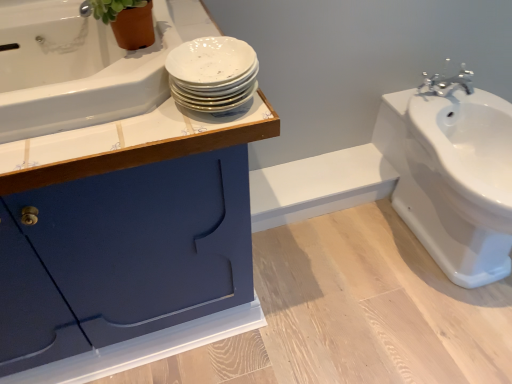
Question: Is white glossy bathtub at upper left oriented towards green matte plant at upper left?

Choices:
 (A) no
 (B) yes

Answer: (A)

Question: Is white glossy bathtub at upper left not near green matte plant at upper left?

Choices:
 (A) yes
 (B) no

Answer: (B)

Question: Is the depth of white glossy bathtub at upper left less than that of green matte plant at upper left?

Choices:
 (A) yes
 (B) no

Answer: (A)

Question: From a real-world perspective, is white glossy bathtub at upper left physically below green matte plant at upper left?

Choices:
 (A) yes
 (B) no

Answer: (A)

Question: From the image's perspective, is white glossy bathtub at upper left located beneath green matte plant at upper left?

Choices:
 (A) yes
 (B) no

Answer: (A)

Question: Is white glossy bathtub at upper left inside or outside of white glossy sink at right?

Choices:
 (A) inside
 (B) outside

Answer: (B)

Question: Is white glossy bathtub at upper left to the left or to the right of white glossy sink at right in the image?

Choices:
 (A) left
 (B) right

Answer: (A)

Question: Is white glossy bathtub at upper left taller or shorter than white glossy sink at right?

Choices:
 (A) tall
 (B) short

Answer: (B)

Question: From a real-world perspective, is white glossy bathtub at upper left above or below white glossy sink at right?

Choices:
 (A) below
 (B) above

Answer: (B)

Question: Considering their positions, is green matte plant at upper left located in front of or behind matte blue cabinet at upper left?

Choices:
 (A) front
 (B) behind

Answer: (B)

Question: From the image's perspective, is green matte plant at upper left located above or below matte blue cabinet at upper left?

Choices:
 (A) below
 (B) above

Answer: (B)

Question: Is green matte plant at upper left bigger or smaller than matte blue cabinet at upper left?

Choices:
 (A) small
 (B) big

Answer: (A)

Question: Based on their positions, is green matte plant at upper left located to the left or right of matte blue cabinet at upper left?

Choices:
 (A) left
 (B) right

Answer: (B)

Question: In the image, is green matte plant at upper left positioned in front of or behind white glossy bathtub at upper left?

Choices:
 (A) front
 (B) behind

Answer: (B)

Question: Is green matte plant at upper left spatially inside white glossy bathtub at upper left, or outside of it?

Choices:
 (A) outside
 (B) inside

Answer: (B)